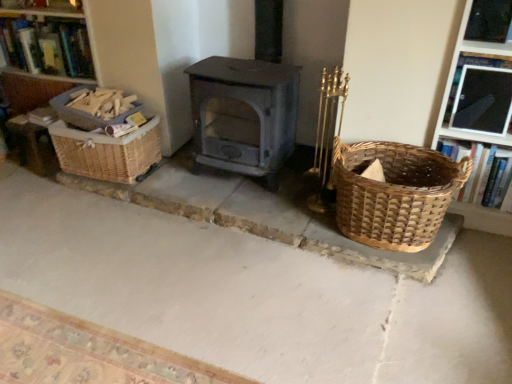
Find the location of `vacant area located to the right-hand side of white woven mat at lower center`. vacant area located to the right-hand side of white woven mat at lower center is located at coordinates (311, 317).